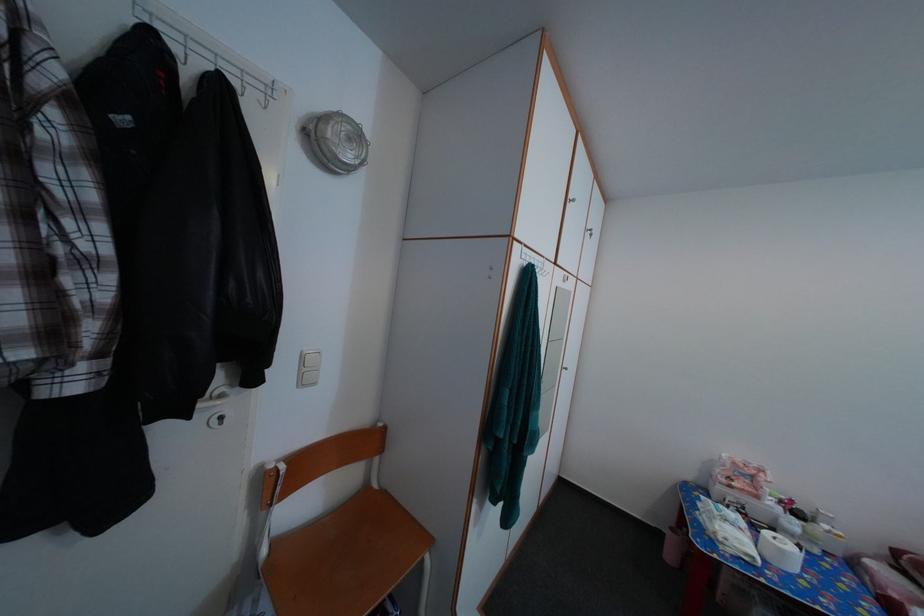
Describe the element at coordinates (216, 419) in the screenshot. I see `the door keyhole` at that location.